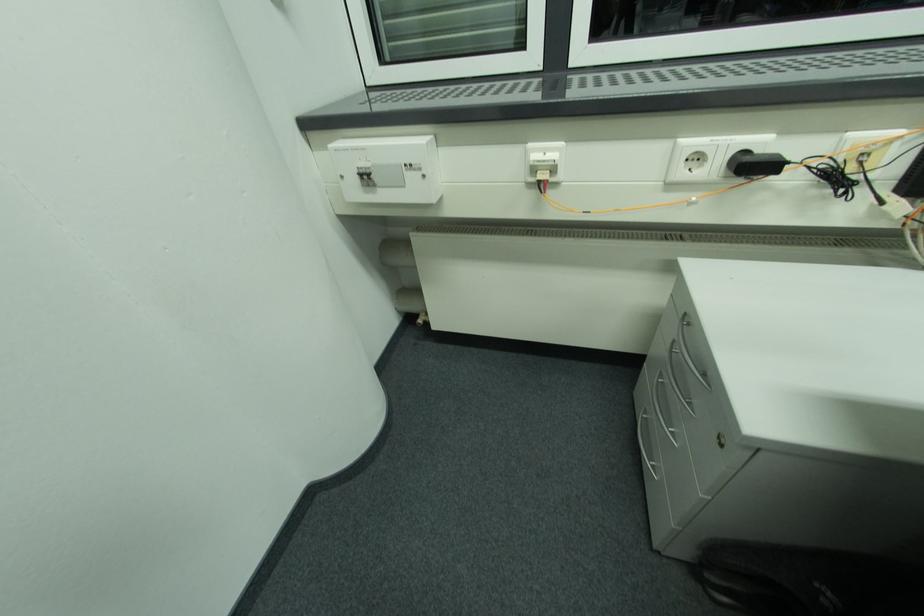
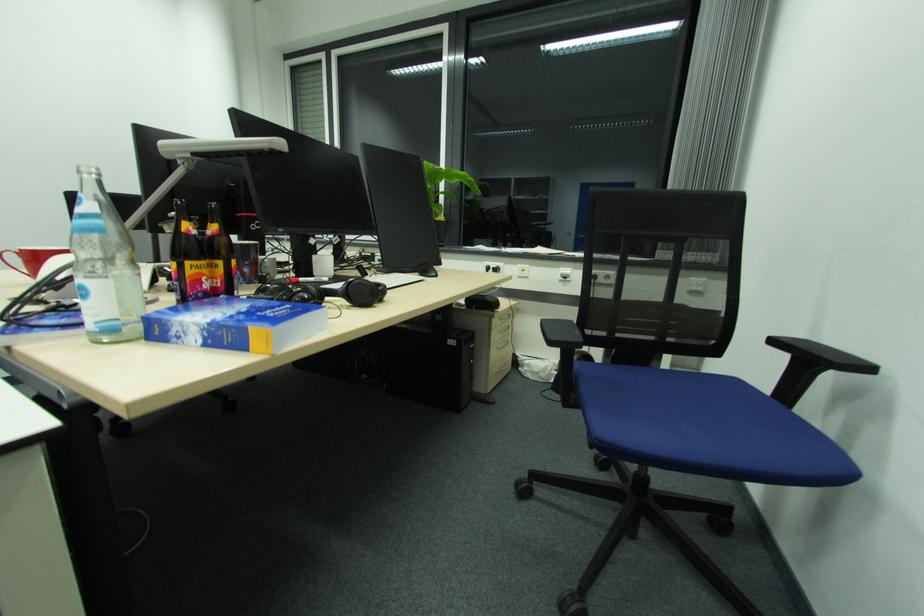
In a continuous first-person perspective shot, in which direction is the camera moving?

The cameraman walked toward right, backward.